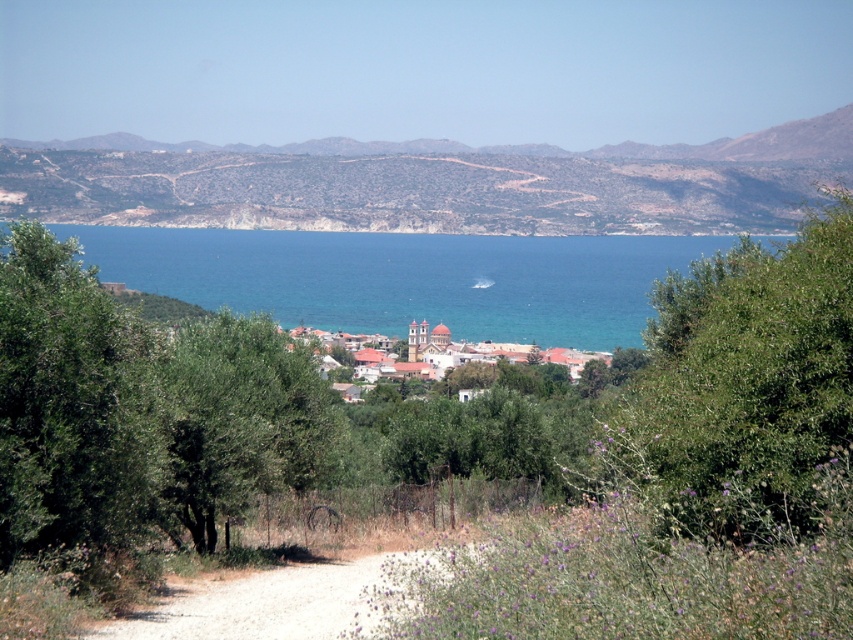
You are planning to place a picnic blanket between the green leafy bush at right and the green leafy tree at left. The blanket is 10 feet wide. Will there be enough space between them to spread out the blanket?

The green leafy bush at right and green leafy tree at left are 37.06 feet apart from each other. Since the picnic blanket is only 10 feet wide, there is more than enough space to spread it out between them.

You are a hiker on the dirt path and want to take a photo of the village with the church in the background. The green leafy bush at right and the green leafy tree at center might block your view. Which object is closer to you and could potentially block your view more?

The green leafy bush at right is positioned over the green leafy tree at center, meaning it is closer to you and would block your view more.